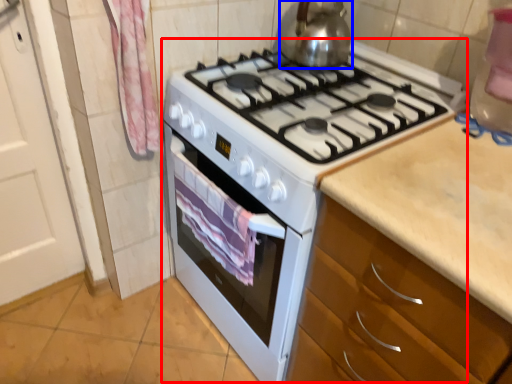
Question: Which object is further to the camera taking this photo, appliance (highlighted by a red box) or kitchen appliance (highlighted by a blue box)?

Choices:
 (A) appliance
 (B) kitchen appliance

Answer: (B)